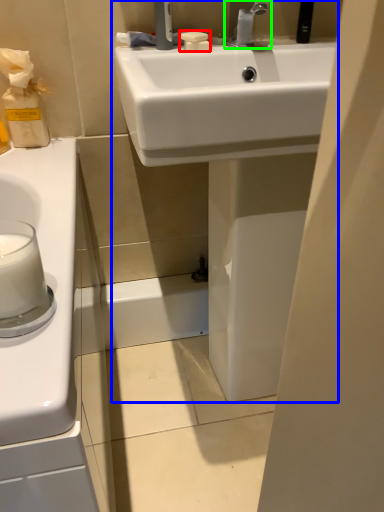
Question: Which object is the closest to the soap (highlighted by a red box)? Choose among these: sink (highlighted by a blue box) or tap (highlighted by a green box).

Choices:
 (A) sink
 (B) tap

Answer: (B)